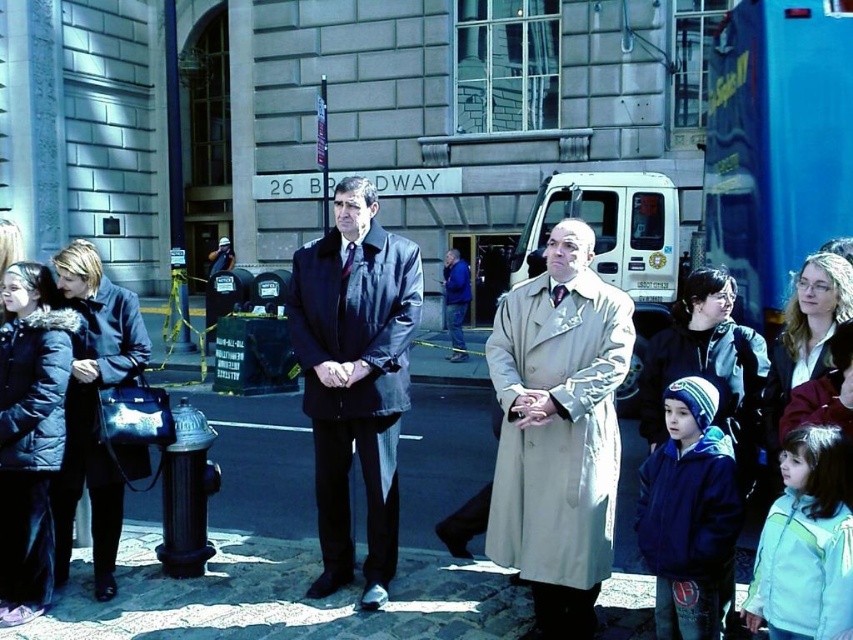
Question: Does beige leather trench coat at center appear on the right side of velvet black coat at left?

Choices:
 (A) yes
 (B) no

Answer: (A)

Question: Does beige leather trench coat at center come behind velvet black coat at left?

Choices:
 (A) yes
 (B) no

Answer: (B)

Question: Which point appears closest to the camera in this image?

Choices:
 (A) (341, 296)
 (B) (511, 352)

Answer: (B)

Question: Which point is closer to the camera taking this photo?

Choices:
 (A) (495, 362)
 (B) (378, 488)

Answer: (A)

Question: Which point is closer to the camera?

Choices:
 (A) dark brown leather jacket at center
 (B) velvet black coat at left
 (C) beige leather trench coat at center

Answer: (C)

Question: Can you confirm if beige leather trench coat at center is bigger than velvet black coat at left?

Choices:
 (A) yes
 (B) no

Answer: (A)